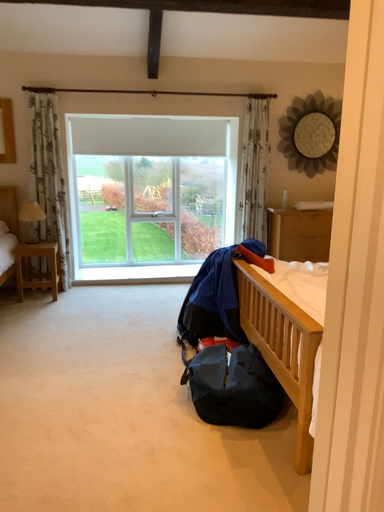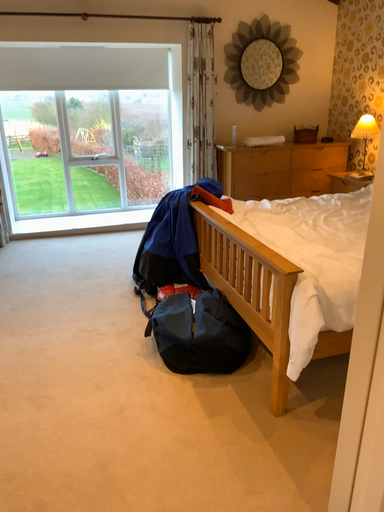
Question: Which way did the camera rotate in the video?

Choices:
 (A) rotated right
 (B) rotated left

Answer: (A)